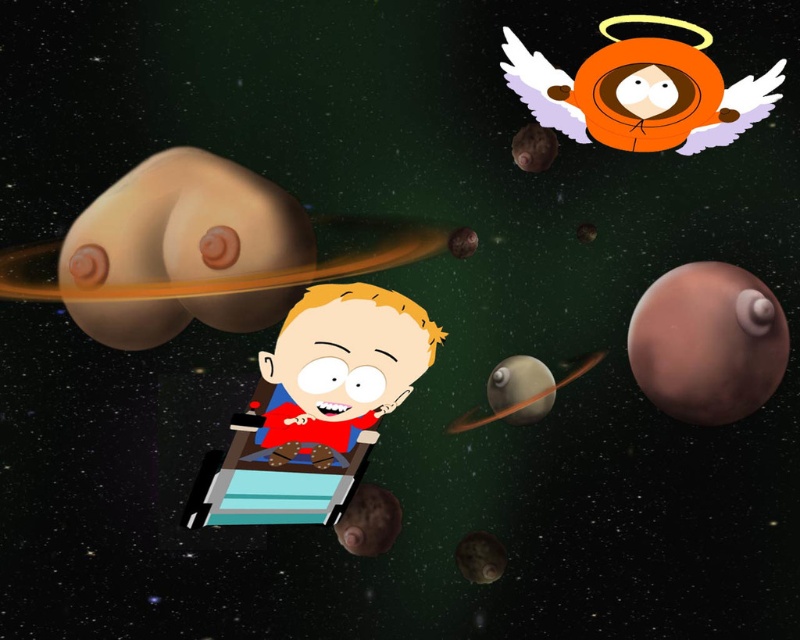
The width and height of the screenshot is (800, 640). Find the location of `brown matte planet at upper right`. brown matte planet at upper right is located at coordinates (708, 342).

Who is positioned more to the right, brown matte planet at upper right or smooth brown planet at lower center?

brown matte planet at upper right

This screenshot has width=800, height=640. Identify the location of brown matte planet at upper right. (708, 342).

Identify the location of smooth beige planet at left. (184, 225).

Is point (96, 332) closer to camera compared to point (484, 580)?

Yes, it is.

This screenshot has height=640, width=800. I want to click on smooth beige planet at left, so point(184,225).

Who is taller, smooth brown planet at center or smooth brown planet at lower center?

With more height is smooth brown planet at center.

Does smooth brown planet at center have a smaller size compared to smooth brown planet at lower center?

No.

Which is behind, point (544, 392) or point (504, 563)?

Point (504, 563)

Locate an element on the screen. smooth brown planet at center is located at coordinates (520, 388).